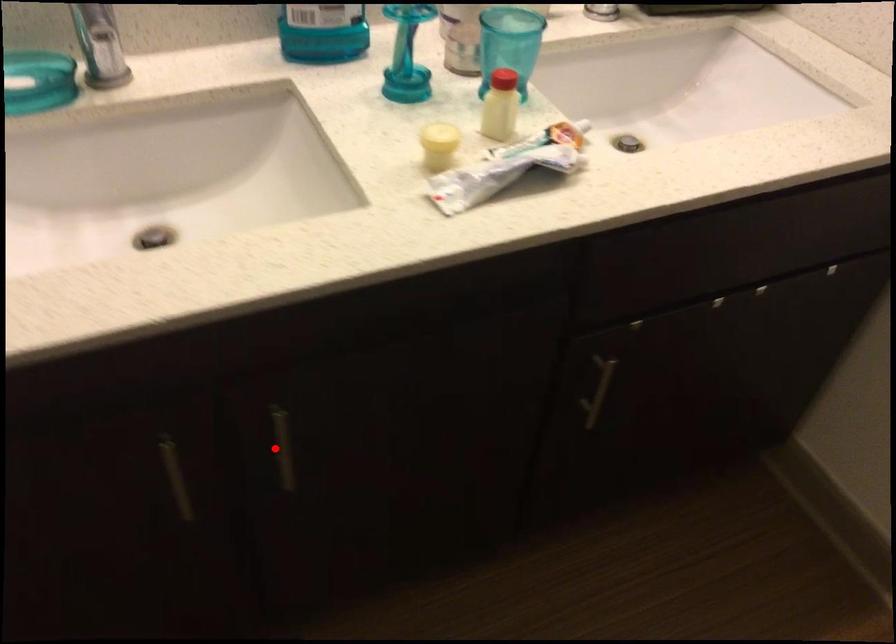
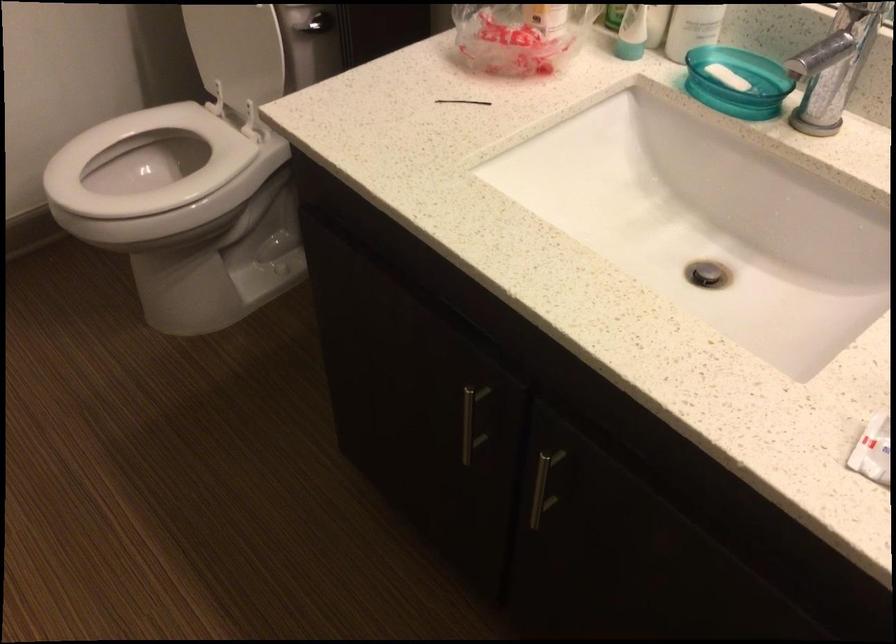
Question: I am providing you with two images of the same scene from different viewpoints. Given a red point in image1, look at the same physical point in image2. Is it:

Choices:
 (A) Closer to the viewpoint
 (B) Farther from the viewpoint

Answer: (A)